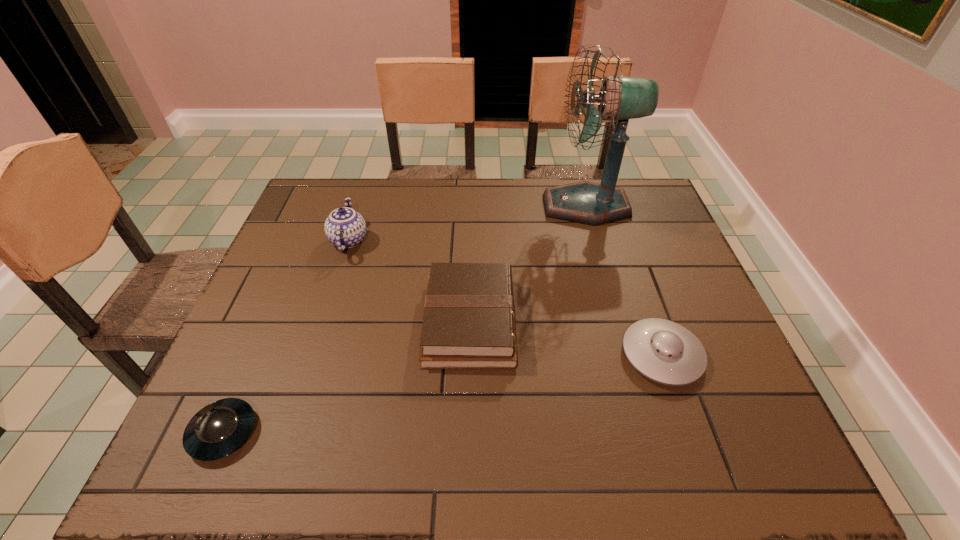
Identify which object is the fourth closest to the fan. Please provide its 2D coordinates. Your answer should be formatted as a tuple, i.e. [(x, y)], where the tuple contains the x and y coordinates of a point satisfying the conditions above.

[(220, 428)]

This screenshot has height=540, width=960. In order to click on vacant space that satisfies the following two spatial constraints: 1. on the back side of the farther saucer; 2. at the spout of the chinaware in this screenshot , I will do `click(622, 240)`.

At what (x,y) coordinates should I click in order to perform the action: click on free space that satisfies the following two spatial constraints: 1. at the spout of the fourth shortest object; 2. on the front side of the leftmost object. Please return your answer as a coordinate pair (x, y). Image resolution: width=960 pixels, height=540 pixels. Looking at the image, I should click on (287, 433).

Locate an element on the screen. This screenshot has height=540, width=960. vacant space that satisfies the following two spatial constraints: 1. in front of the tallest object where the wind blows; 2. on the back side of the fourth tallest object is located at coordinates (629, 355).

Identify the location of vacant position in the image that satisfies the following two spatial constraints: 1. on the spine side of the third shortest object; 2. on the left side of the right saucer. Image resolution: width=960 pixels, height=540 pixels. (469, 355).